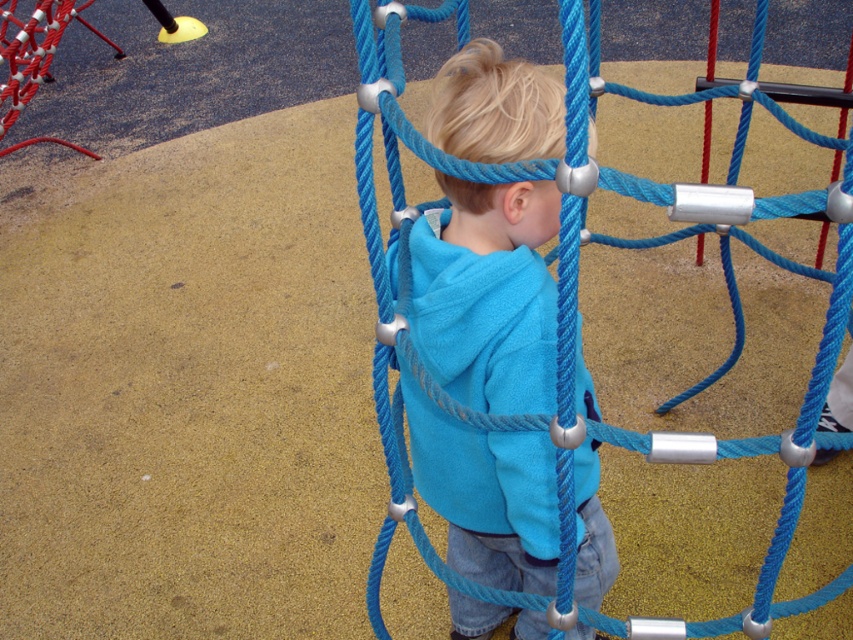
You are a parent watching your child play at the playground. You see the blue fleece jacket at center and the blue rope net at center. Which object is closer to you?

The blue fleece jacket at center is closer to you because it is further to the viewer than the blue rope net at center.

You are a parent supervising a child at the playground. You notice the blue fleece jacket at center. Based on its position coordinates, can you estimate whether it is closer to the climbing structure or the safety surfacing material?

The blue fleece jacket at center is located at point (486, 294). Since the coordinates are closer to the climbing structure, the jacket is near the climbing area.